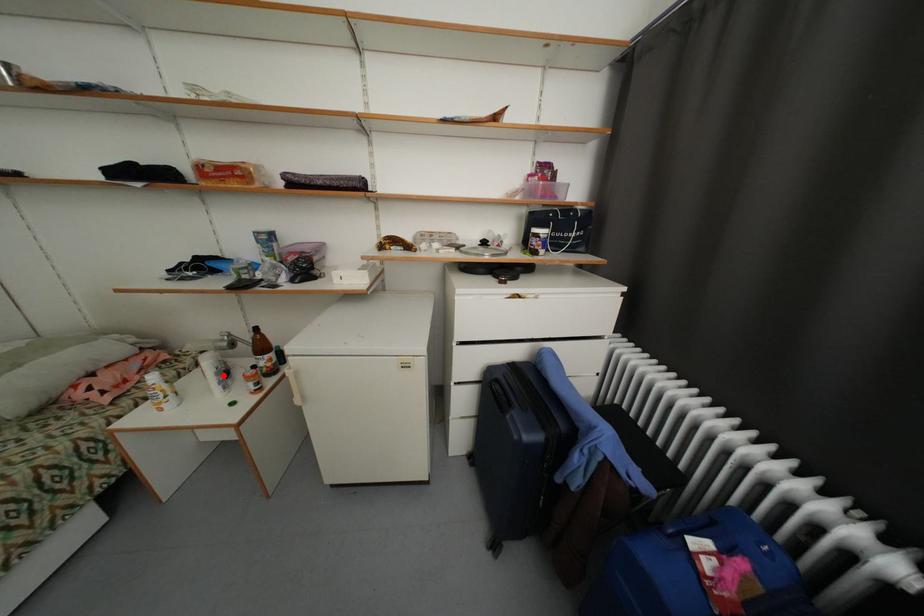
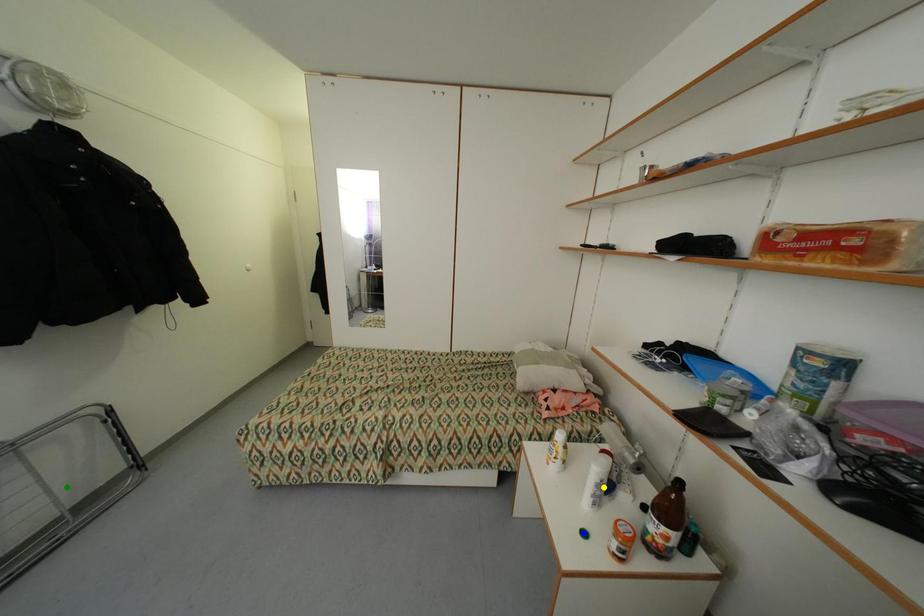
Question: I am providing you with two images of the same scene from different viewpoints. A red point is marked on the first image. You are given multiple points on the second image. Can you choose the point in image 2 that corresponds to the point in image 1?

Choices:
 (A) yellow point
 (B) green point
 (C) blue point

Answer: (A)